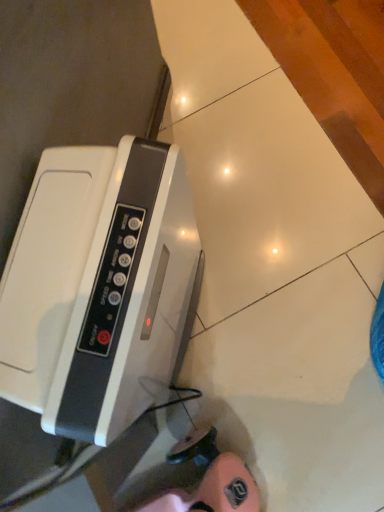
The image size is (384, 512). I want to click on vacant point above white plastic air purifier at left (from a real-world perspective), so click(x=92, y=274).